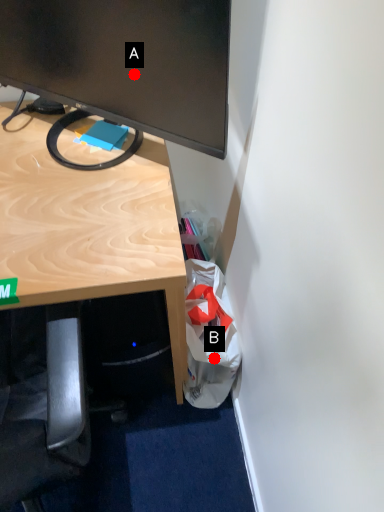
Question: Two points are circled on the image, labeled by A and B beside each circle. Which point is closer to the camera?

Choices:
 (A) A is closer
 (B) B is closer

Answer: (A)